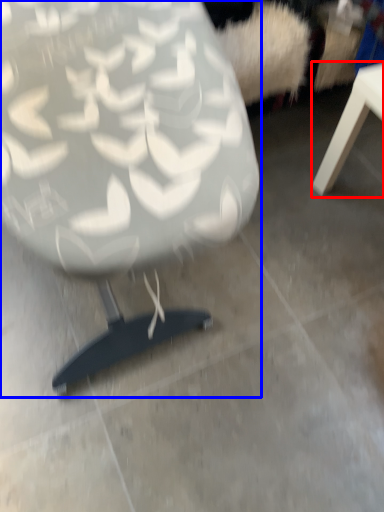
Question: Among these objects, which one is nearest to the camera, table (highlighted by a red box) or chair (highlighted by a blue box)?

Choices:
 (A) table
 (B) chair

Answer: (B)